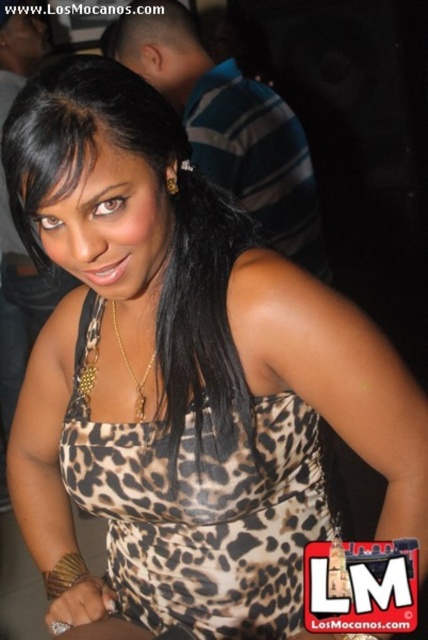
Where is the leopard print dress at center located in the image?

The leopard print dress at center is located at the 2D point coordinates of 0.327 along the x axis and 0.397 along the y axis.

You are a photographer at a social event. You want to take a closeup shot of the woman in the leopard print fabric dress at center and the gold chain at center. What is the minimum distance you need to maintain between the camera and the subjects to capture both in the frame?

The leopard print fabric dress at center is 7.88 inches away from the gold chain at center. To capture both in the frame, the minimum distance should be at least 7.88 inches.

You are a photographer at the event and want to ensure the woman in the leopard print fabric dress at center and the gold chain at center are both visible in the photo. Given their sizes, which one will appear larger in the frame?

The leopard print fabric dress at center is taller than the gold chain at center, so the leopard print fabric dress at center will appear larger in the frame.